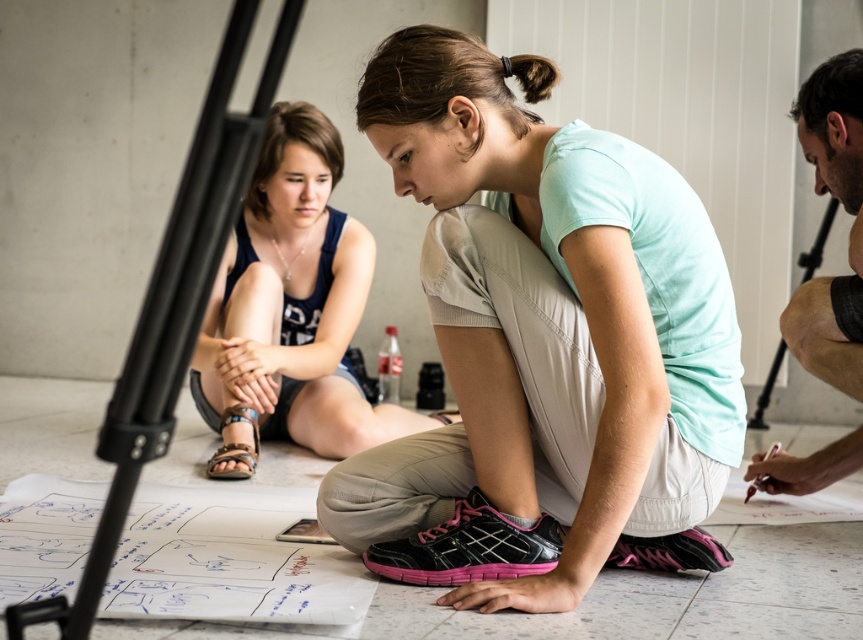
Does point (584, 451) come closer to viewer compared to point (854, 157)?

Yes, point (584, 451) is closer to viewer.

Does matte light blue shirt at center appear over smooth skin man at right?

Actually, matte light blue shirt at center is below smooth skin man at right.

The image size is (863, 640). In order to click on matte light blue shirt at center in this screenshot , I will do `click(540, 339)`.

Does matte light blue shirt at center have a larger size compared to matte white shorts at center?

Incorrect, matte light blue shirt at center is not larger than matte white shorts at center.

Who is more forward, (523, 588) or (215, 396)?

Positioned in front is point (523, 588).

You are a GUI agent. You are given a task and a screenshot of the screen. Output one action in this format:
    pyautogui.click(x=<x>, y=<y>)
    Task: Click on the matte light blue shirt at center
    Image resolution: width=863 pixels, height=640 pixels.
    Given the screenshot: What is the action you would take?
    pyautogui.click(x=540, y=339)

How far apart are matte white shorts at center and smooth skin man at right?

matte white shorts at center and smooth skin man at right are 1.38 meters apart.

What do you see at coordinates (290, 310) in the screenshot? I see `matte white shorts at center` at bounding box center [290, 310].

Identify the location of matte white shorts at center. This screenshot has height=640, width=863. (290, 310).